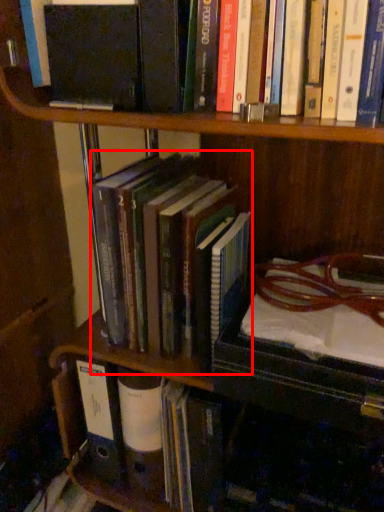
Question: From the image's perspective, where is book (annotated by the red box) located in relation to book in the image?

Choices:
 (A) above
 (B) below

Answer: (A)